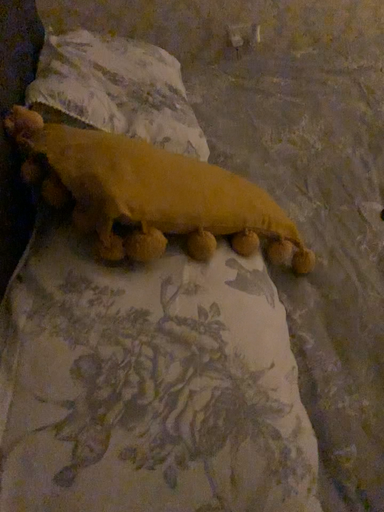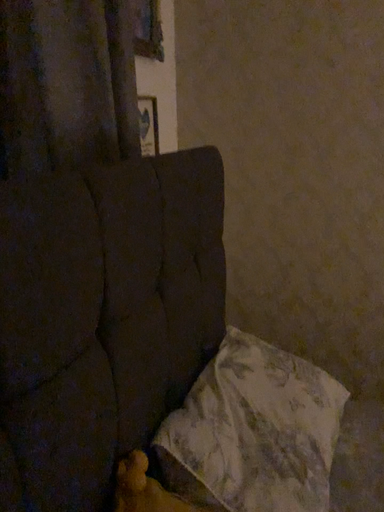
Question: How did the camera likely rotate when shooting the video?

Choices:
 (A) rotated downward
 (B) rotated upward

Answer: (B)